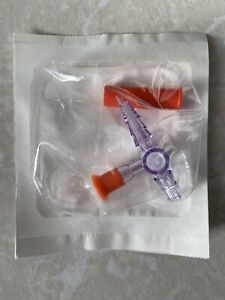
Identify the location of table. (116, 266).